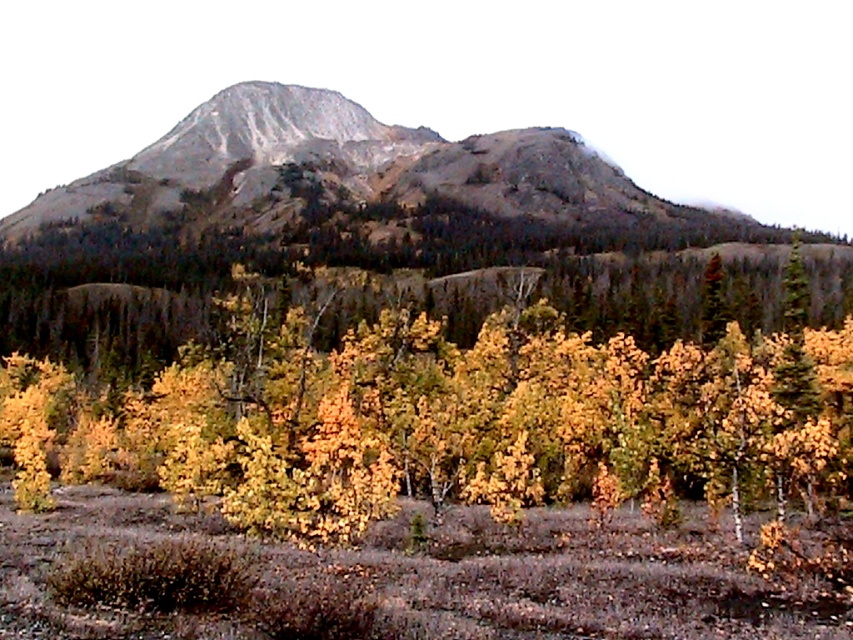
Looking at this image, can you confirm if yellow matte tree at center is thinner than gray rock mountain at center?

Yes.

Is yellow matte tree at center above gray rock mountain at center?

No, yellow matte tree at center is not above gray rock mountain at center.

Where is `yellow matte tree at center`? This screenshot has width=853, height=640. yellow matte tree at center is located at coordinates (469, 417).